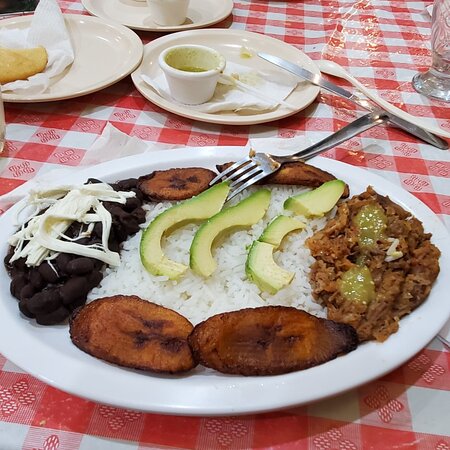
Find the location of `plate`. plate is located at coordinates (217, 388), (95, 46), (119, 16), (224, 34).